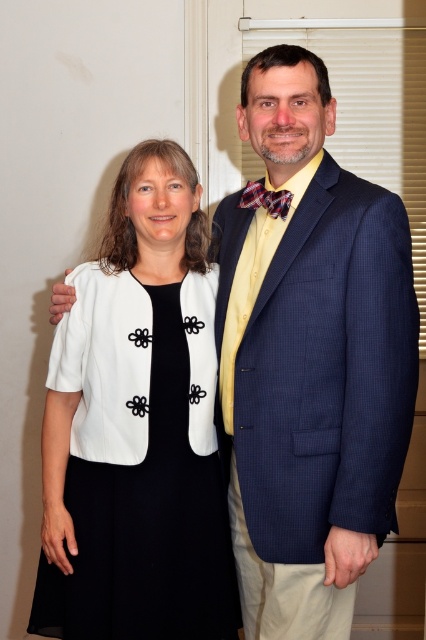
Question: Which is farther from the plaid fabric bow tie at center?

Choices:
 (A) white matte dress at center
 (B) navy blue textured suit at right

Answer: (A)

Question: Does navy blue textured suit at right lie behind plaid fabric bow tie at center?

Choices:
 (A) no
 (B) yes

Answer: (A)

Question: Which object is closer to the camera taking this photo?

Choices:
 (A) navy blue textured suit at right
 (B) white matte dress at center
 (C) plaid fabric bow tie at center

Answer: (A)

Question: Which is nearer to the white matte dress at center?

Choices:
 (A) navy blue textured suit at right
 (B) plaid fabric bow tie at center

Answer: (A)

Question: Can you confirm if white matte dress at center is thinner than plaid fabric bow tie at center?

Choices:
 (A) yes
 (B) no

Answer: (B)

Question: Can you confirm if navy blue textured suit at right is positioned to the right of plaid fabric bow tie at center?

Choices:
 (A) no
 (B) yes

Answer: (A)